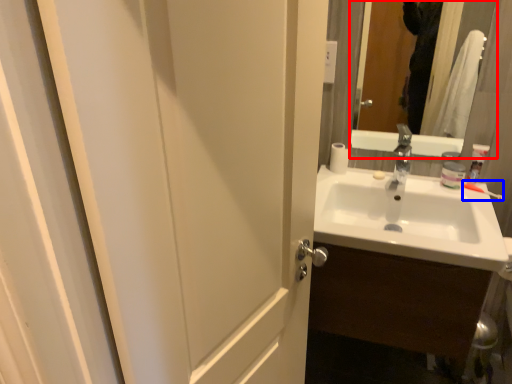
Question: Which point is further to the camera, mirror (highlighted by a red box) or toothbrush (highlighted by a blue box)?

Choices:
 (A) mirror
 (B) toothbrush

Answer: (B)